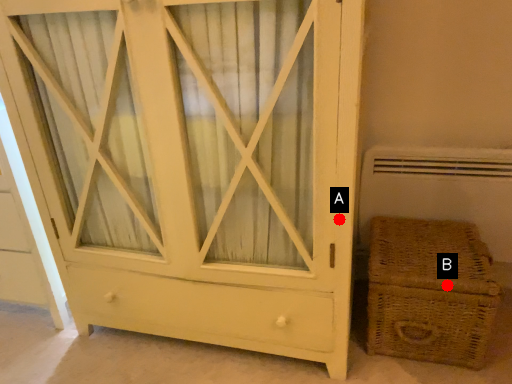
Question: Two points are circled on the image, labeled by A and B beside each circle. Which point is further to the camera?

Choices:
 (A) A is further
 (B) B is further

Answer: (B)